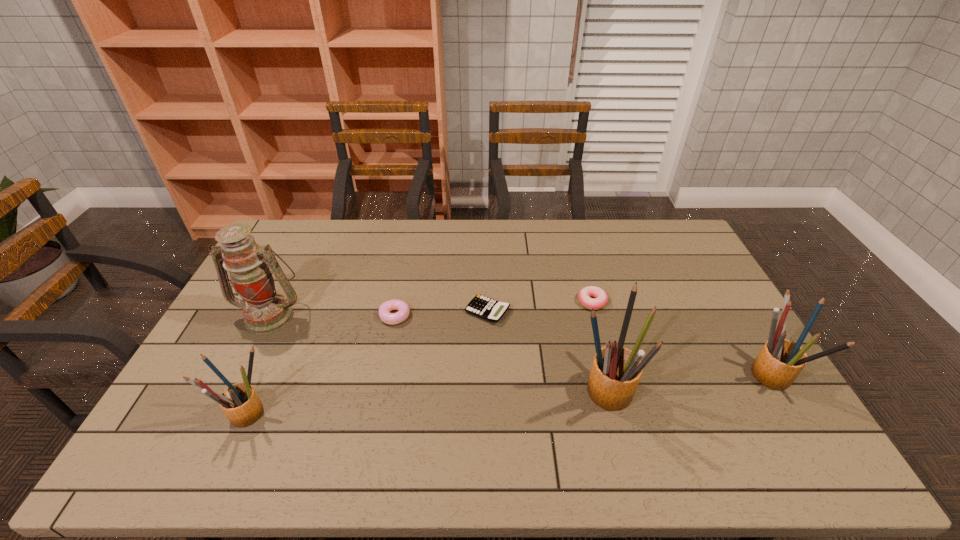
The width and height of the screenshot is (960, 540). Identify the location of vacant space that's between the shortest pencil box and the fifth object from right to left. (320, 364).

Locate an element on the screen. free spot between the oil lamp and the shortest object is located at coordinates pos(379,313).

Locate an element on the screen. Image resolution: width=960 pixels, height=540 pixels. vacant area between the shortest pencil box and the third tallest object is located at coordinates (508, 394).

What are the coordinates of `free space that is in between the fourth shortest object and the calculator` in the screenshot? It's located at (367, 362).

Where is `empty location between the second pencil box from left to right and the leftmost pencil box`? The height and width of the screenshot is (540, 960). empty location between the second pencil box from left to right and the leftmost pencil box is located at coordinates (424, 400).

The image size is (960, 540). What are the coordinates of `free spot between the shortest object and the tallest pencil box` in the screenshot? It's located at (545, 349).

Identify the location of object that ranks as the second closest to the left doughnut. The image size is (960, 540). (265, 311).

Find the location of `object that stands as the sixth closest to the right doughnut`. object that stands as the sixth closest to the right doughnut is located at coordinates (240, 403).

Identify which pencil box is the second closest to the fifth shortest object. Please provide its 2D coordinates. Your answer should be formatted as a tuple, i.e. [(x, y)], where the tuple contains the x and y coordinates of a point satisfying the conditions above.

[(240, 403)]

This screenshot has height=540, width=960. I want to click on pencil box that is the closest to the rightmost object, so (616, 371).